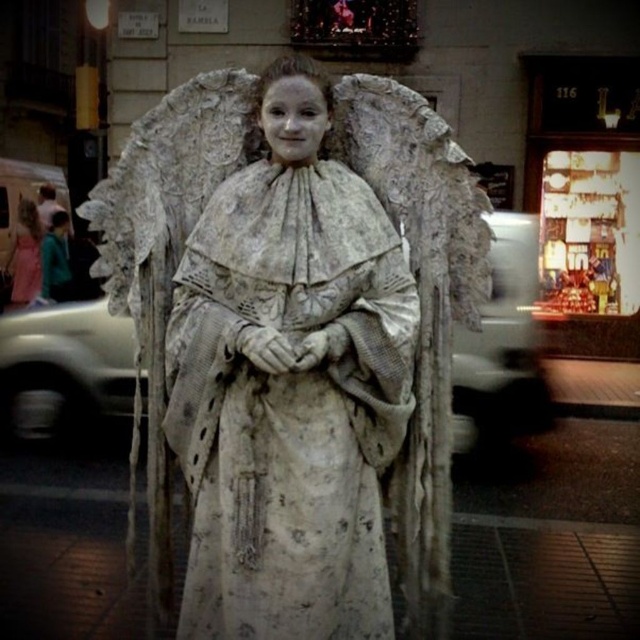
You are a photographer trying to capture the matte white dress at left and the teal fabric jacket at left in a single shot. Since the background is busy, you want to ensure both items are clearly visible. Which object should you focus on to keep both in sharp focus?

To ensure both the matte white dress at left and the teal fabric jacket at left are in sharp focus, you should focus on the teal fabric jacket at left since it is further away from the camera than the matte white dress at left, so focusing on it will include the closer object in the depth of field.